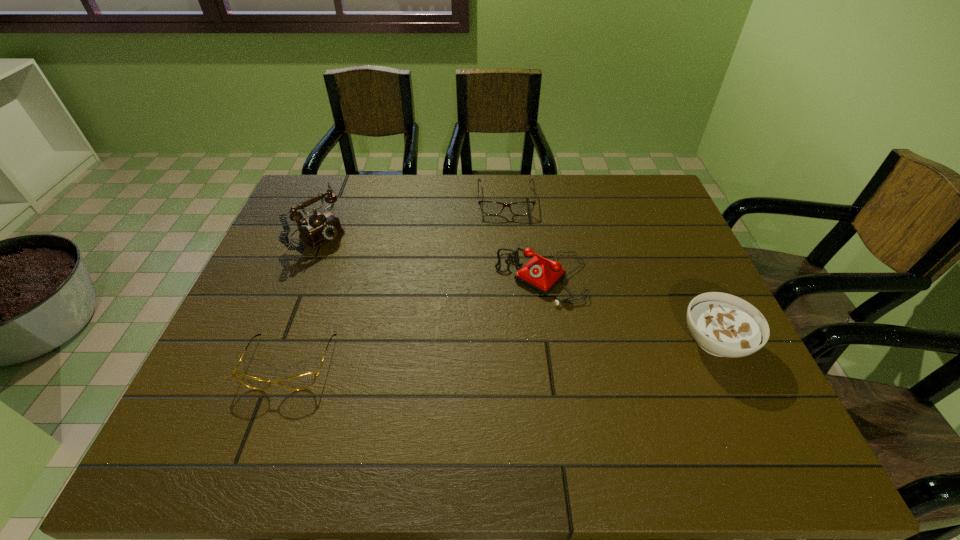
Locate an element on the screen. This screenshot has height=540, width=960. vacant spot on the desktop that is between the nearer spectacles and the soup bowl and is positioned on the lenses of the farther spectacles is located at coordinates pyautogui.click(x=513, y=352).

Image resolution: width=960 pixels, height=540 pixels. Identify the location of vacant spot on the desktop that is between the nearer spectacles and the soup bowl and is positioned on the dial of the tallest object. (513, 352).

This screenshot has height=540, width=960. What are the coordinates of `free space on the desktop that is between the nearer spectacles and the soup bowl and is positioned on the dial of the right telephone` in the screenshot? It's located at (466, 354).